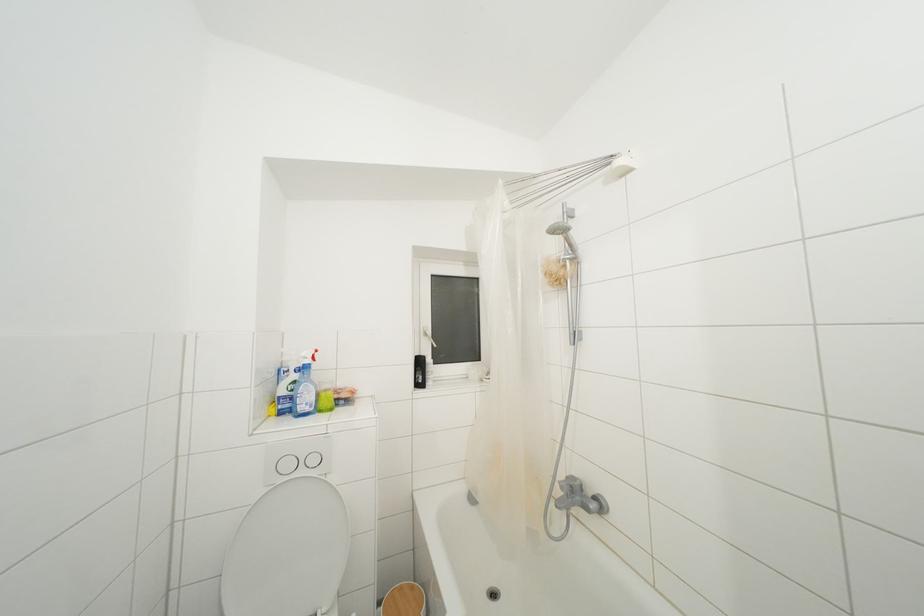
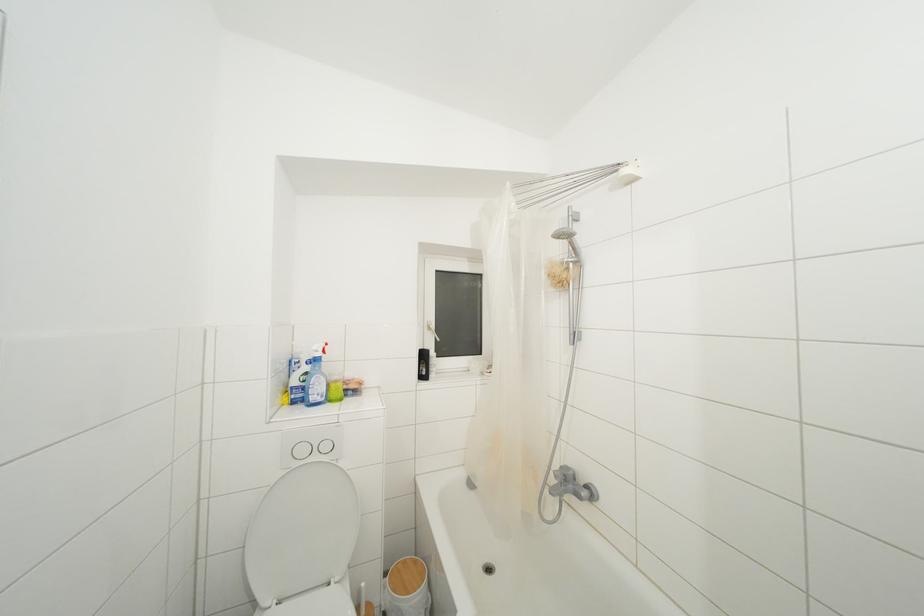
In the second image, find the point that corresponds to pixel 568 270 in the first image.

(572, 273)